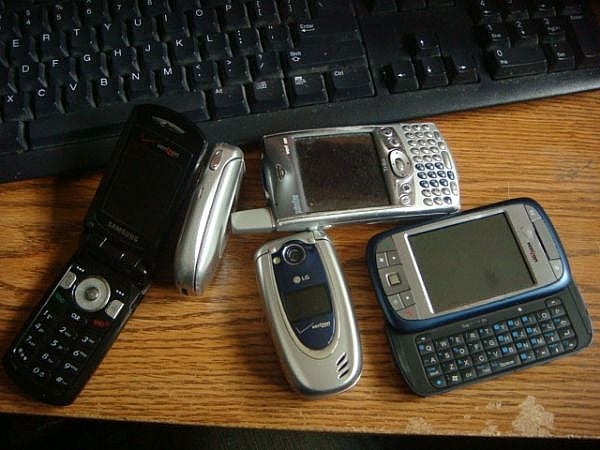
The image size is (600, 450). Identify the location of desk. (515, 160).